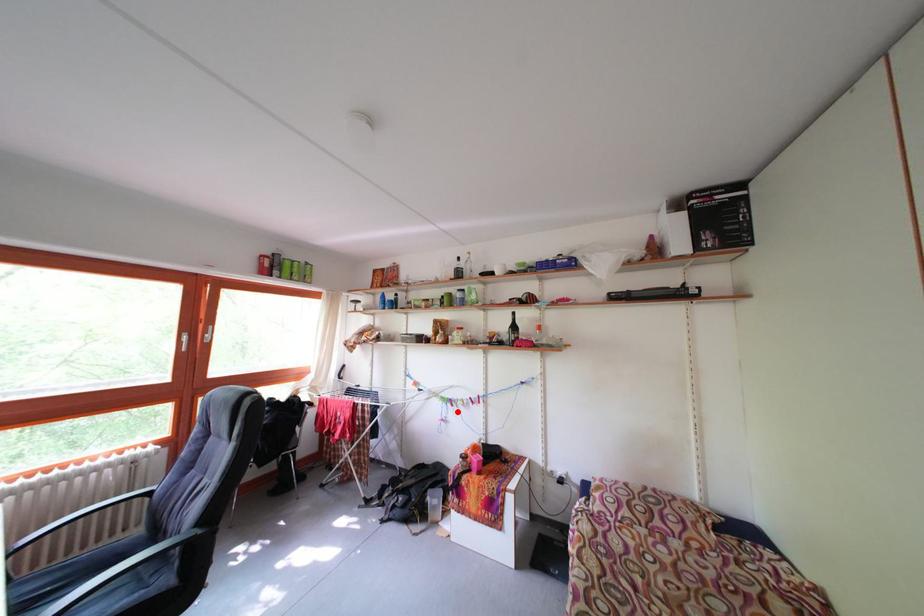
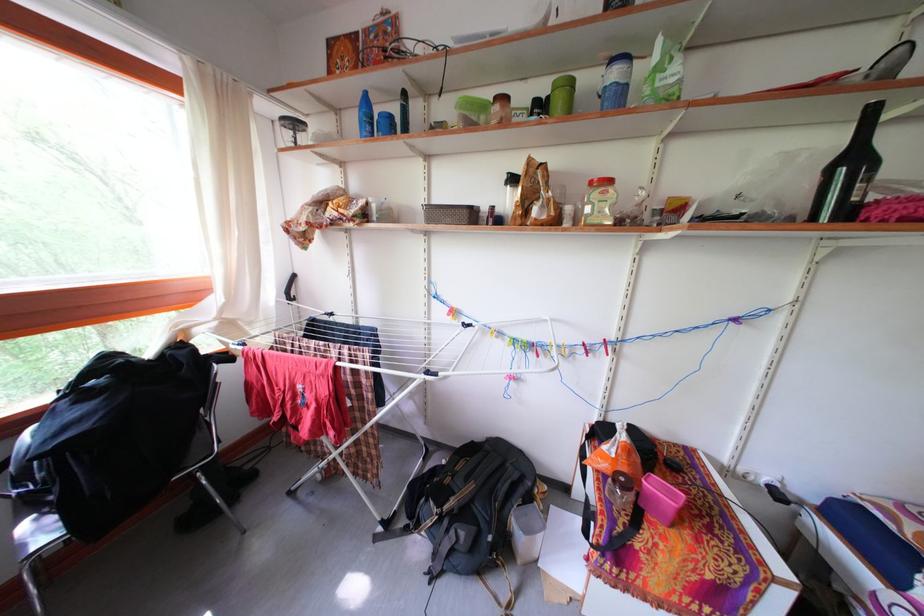
Question: I am providing you with two images of the same scene from different viewpoints. A red point is shown in image1. For the corresponding object point in image2, is it positioned nearer or farther from the camera?

Choices:
 (A) Nearer
 (B) Farther

Answer: (A)